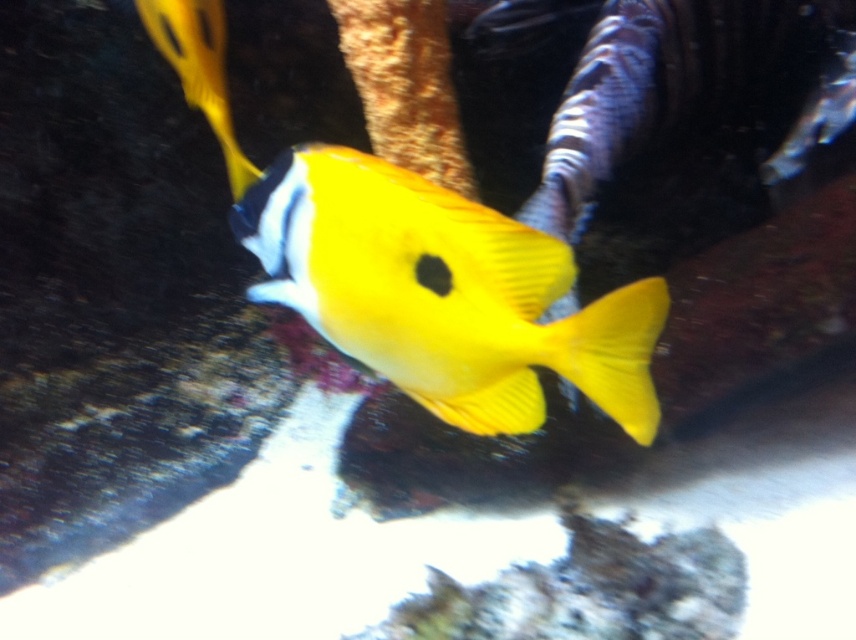
In the scene shown: Is yellow matte fish at center to the left of yellow matte fish at upper left from the viewer's perspective?

In fact, yellow matte fish at center is to the right of yellow matte fish at upper left.

Is the position of yellow matte fish at center less distant than that of yellow matte fish at upper left?

Yes, it is in front of yellow matte fish at upper left.

Image resolution: width=856 pixels, height=640 pixels. I want to click on yellow matte fish at center, so click(x=443, y=292).